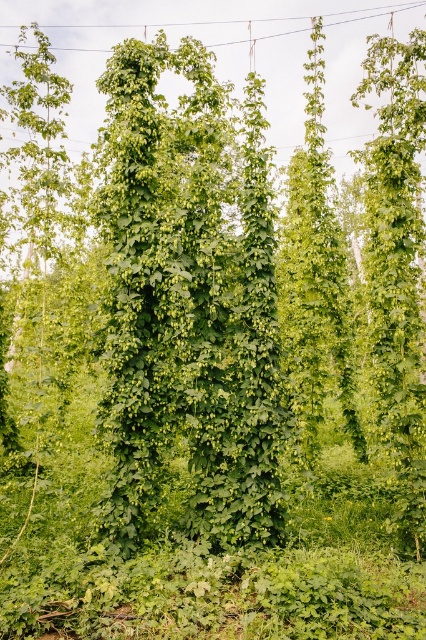
Does green leafy plant at center have a greater height compared to metallic wire at upper center?

Yes.

Where is `green leafy plant at center`? The height and width of the screenshot is (640, 426). green leafy plant at center is located at coordinates (192, 305).

Is point (207, 342) farther from viewer compared to point (83, 28)?

No.

Where is `green leafy plant at center`? green leafy plant at center is located at coordinates (192, 305).